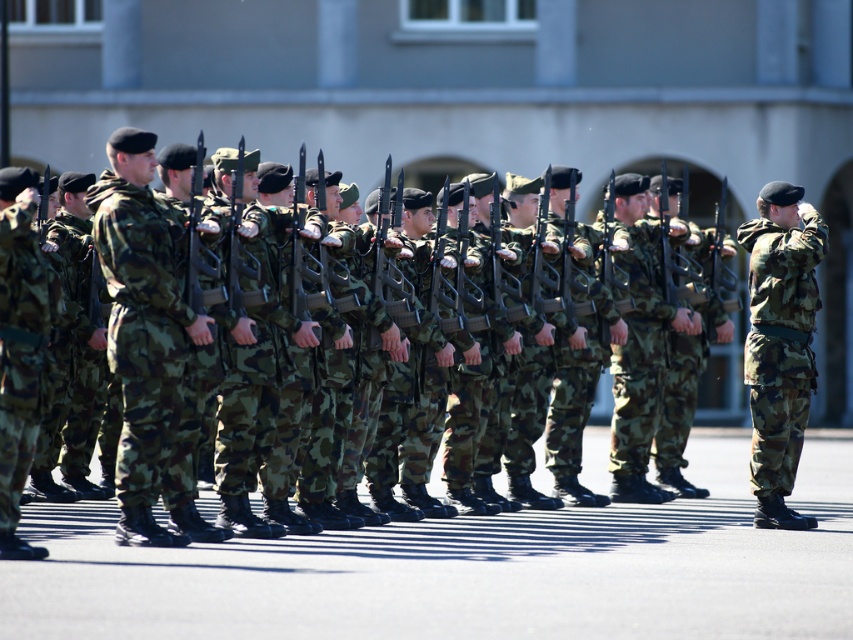
Is camouflage fabric uniform at center to the left of camouflage fabric uniform at left from the viewer's perspective?

Incorrect, camouflage fabric uniform at center is not on the left side of camouflage fabric uniform at left.

Is point (136, 212) positioned in front of point (18, 275)?

That is False.

Locate an element on the screen. camouflage fabric uniform at center is located at coordinates (142, 326).

Who is positioned more to the right, camo uniform at right or camo fabric pants at center?

camo uniform at right is more to the right.

Is point (791, 356) closer to camera compared to point (648, 292)?

Yes, point (791, 356) is in front of point (648, 292).

At what (x,y) coordinates should I click in order to perform the action: click on camo uniform at right. Please return your answer as a coordinate pair (x, y). Looking at the image, I should click on (780, 342).

Is point (126, 492) more distant than point (648, 410)?

No, (126, 492) is closer to viewer.

Can you confirm if camouflage fabric uniform at center is positioned above camo fabric pants at center?

Yes, camouflage fabric uniform at center is above camo fabric pants at center.

Which is in front, point (115, 250) or point (668, 320)?

Point (115, 250) is more forward.

Find the location of a particular element. This screenshot has width=853, height=640. camouflage fabric uniform at center is located at coordinates (142, 326).